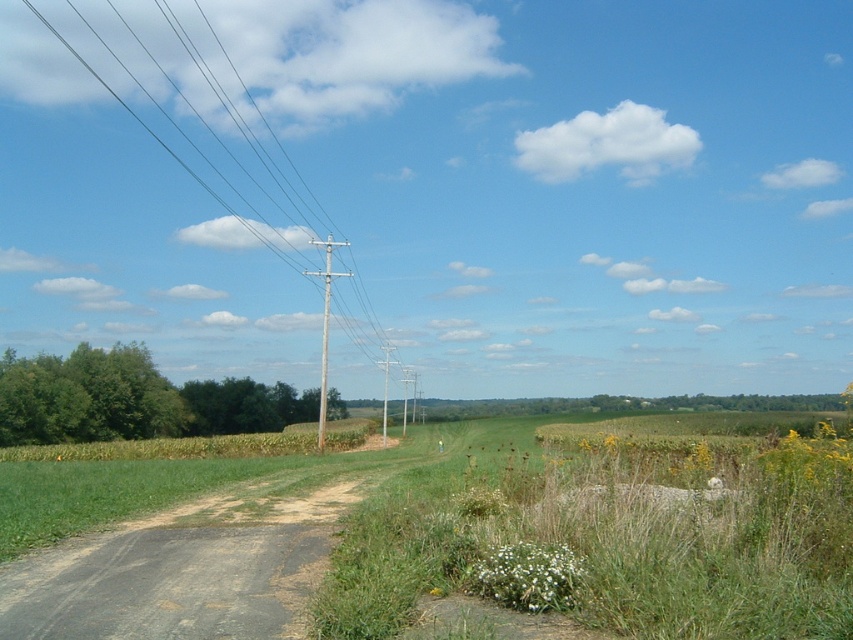
Question: Which point is farther from the camera taking this photo?

Choices:
 (A) (340, 275)
 (B) (146, 570)

Answer: (A)

Question: Is metallic wire at upper left bigger than brown wooden telegraph pole at center?

Choices:
 (A) no
 (B) yes

Answer: (B)

Question: Which point is closer to the camera?

Choices:
 (A) brown wooden telegraph pole at center
 (B) metallic wire at upper left
 (C) dull gray asphalt at lower left

Answer: (C)

Question: Does metallic wire at upper left appear on the right side of brown wooden telegraph pole at center?

Choices:
 (A) yes
 (B) no

Answer: (B)

Question: Which of the following is the closest to the observer?

Choices:
 (A) metallic wire at upper left
 (B) brown wooden telegraph pole at center

Answer: (B)

Question: Does dull gray asphalt at lower left appear on the left side of metallic wire at upper left?

Choices:
 (A) yes
 (B) no

Answer: (B)